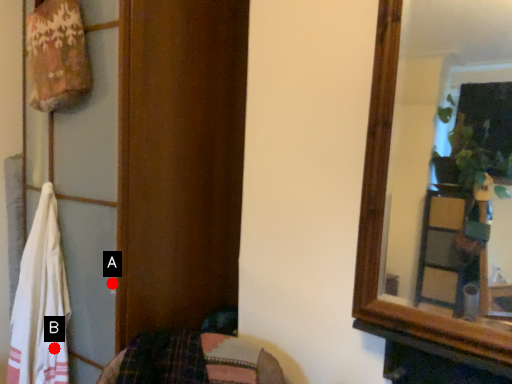
Question: Two points are circled on the image, labeled by A and B beside each circle. Which point is closer to the camera taking this photo?

Choices:
 (A) A is closer
 (B) B is closer

Answer: (A)